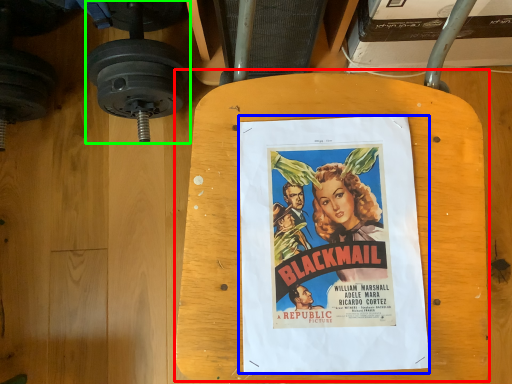
Question: Which is farther away from table (highlighted by a red box)? poster (highlighted by a blue box) or dumbbell (highlighted by a green box)?

Choices:
 (A) poster
 (B) dumbbell

Answer: (B)